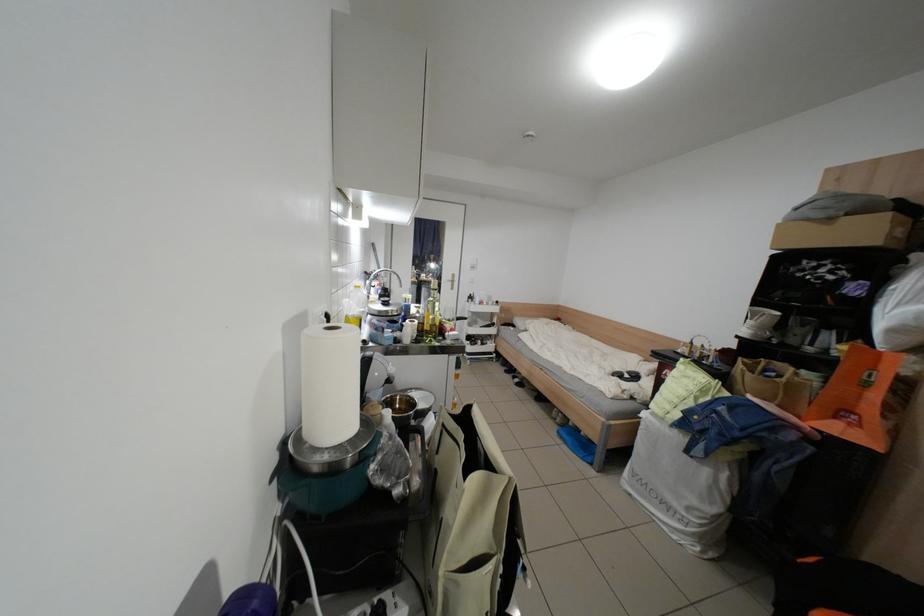
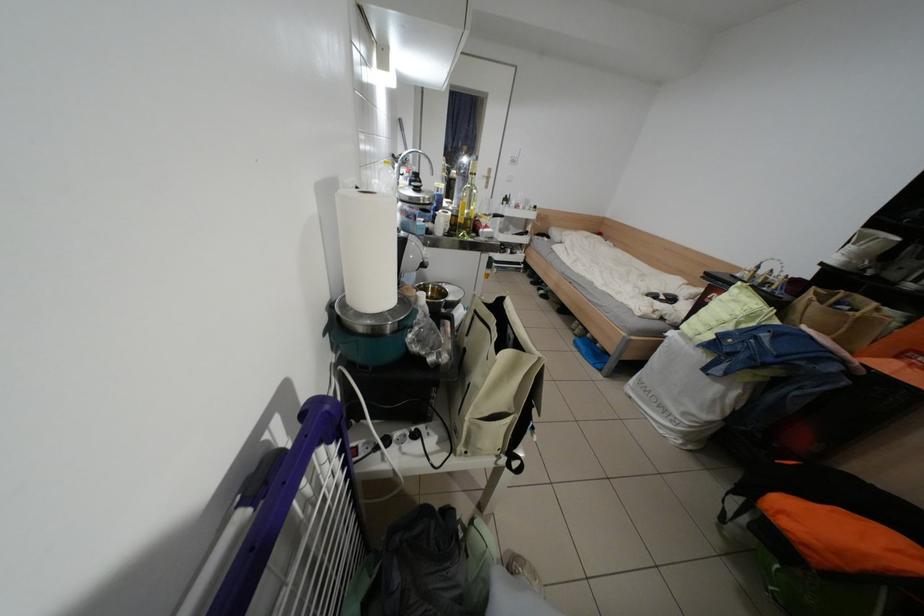
The point at (439, 329) is marked in the first image. Where is the corresponding point in the second image?

(472, 222)